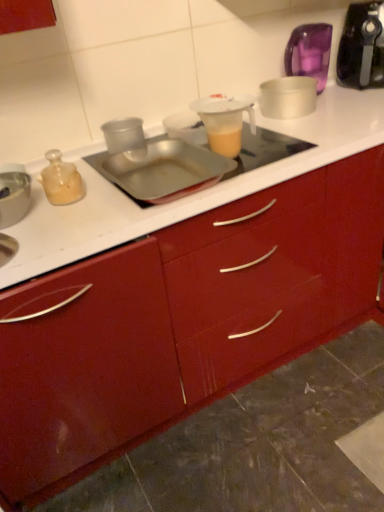
Identify the location of unoccupied region to the right of translucent plastic pitcher at center. (284, 153).